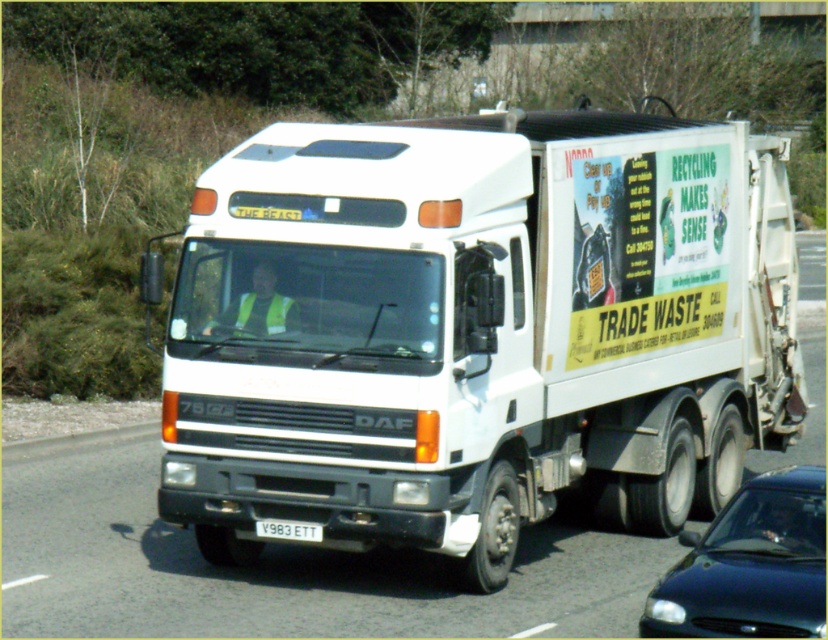
Consider the image. Is white matte truck at center positioned in front of metallic blue sedan at lower right?

That is False.

Between point (788, 396) and point (725, 556), which one is positioned in front?

Point (725, 556) is more forward.

At what (x,y) coordinates should I click in order to perform the action: click on white matte truck at center. Please return your answer as a coordinate pair (x, y). This screenshot has height=640, width=828. Looking at the image, I should click on (477, 330).

Is white matte truck at center to the left of white plastic license plate at center from the viewer's perspective?

No, white matte truck at center is not to the left of white plastic license plate at center.

Consider the image. Can you confirm if white matte truck at center is wider than white plastic license plate at center?

In fact, white matte truck at center might be narrower than white plastic license plate at center.

Which is in front, point (248, 291) or point (282, 540)?

Point (282, 540)

Find the location of a particular element. Image resolution: width=828 pixels, height=640 pixels. white matte truck at center is located at coordinates (477, 330).

Which is in front, point (681, 536) or point (287, 536)?

Point (287, 536)

Does point (759, 611) come closer to viewer compared to point (290, 529)?

That is True.

Locate an element on the screen. The width and height of the screenshot is (828, 640). metallic blue sedan at lower right is located at coordinates (749, 564).